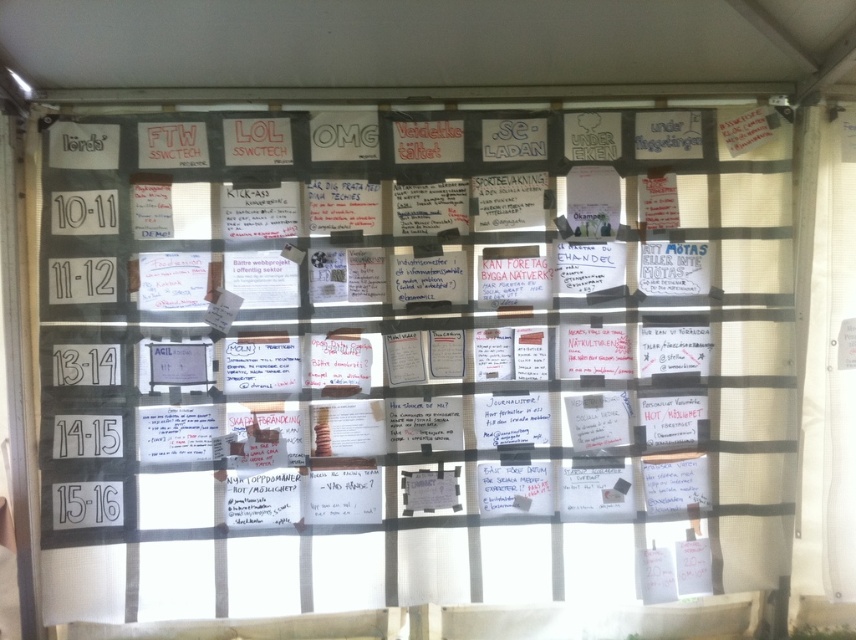
Question: Can you confirm if white paper notes at center is wider than white sheer curtain at right?

Choices:
 (A) no
 (B) yes

Answer: (B)

Question: Is white paper notes at center above white sheer curtain at right?

Choices:
 (A) yes
 (B) no

Answer: (B)

Question: Which point appears closest to the camera in this image?

Choices:
 (A) (302, 465)
 (B) (837, 250)

Answer: (A)

Question: Which point is closer to the camera?

Choices:
 (A) white paper notes at center
 (B) white sheer curtain at right

Answer: (A)

Question: Does white paper notes at center have a greater width compared to white sheer curtain at right?

Choices:
 (A) no
 (B) yes

Answer: (B)